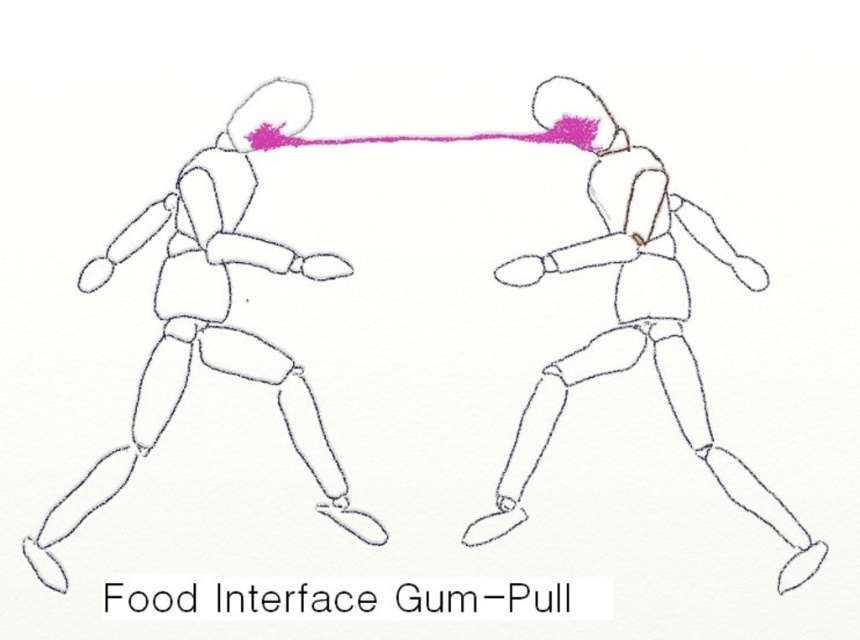
You are a delivery robot with a 12 inch wide package. You need to pass between the matte black figure at left and the smooth white figure at center. Can you fit through the space between them without tilting the package?

The matte black figure at left and the smooth white figure at center are 12.62 inches apart, so yes, the delivery robot can fit through the space between them with the 12 inch wide package since the gap is slightly wider than the package.

You are standing in front of the image described. There are two figures here, the matte black figure at left and the smooth white figure at center. Which one is positioned more to the right side of the image?

The smooth white figure at center is positioned more to the right side of the image than the matte black figure at left.